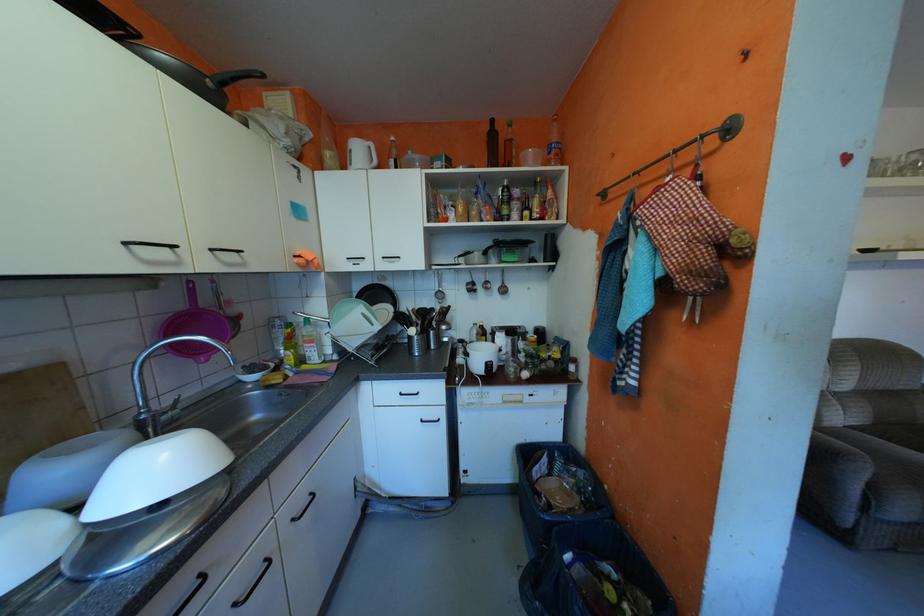
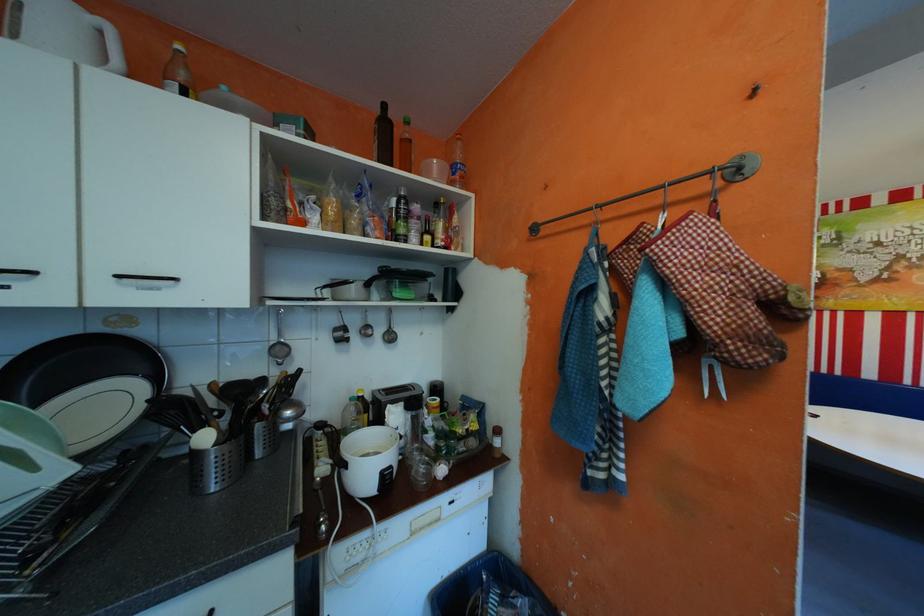
Find the pixel in the second image that matches point 370,147 in the first image.

(66, 12)